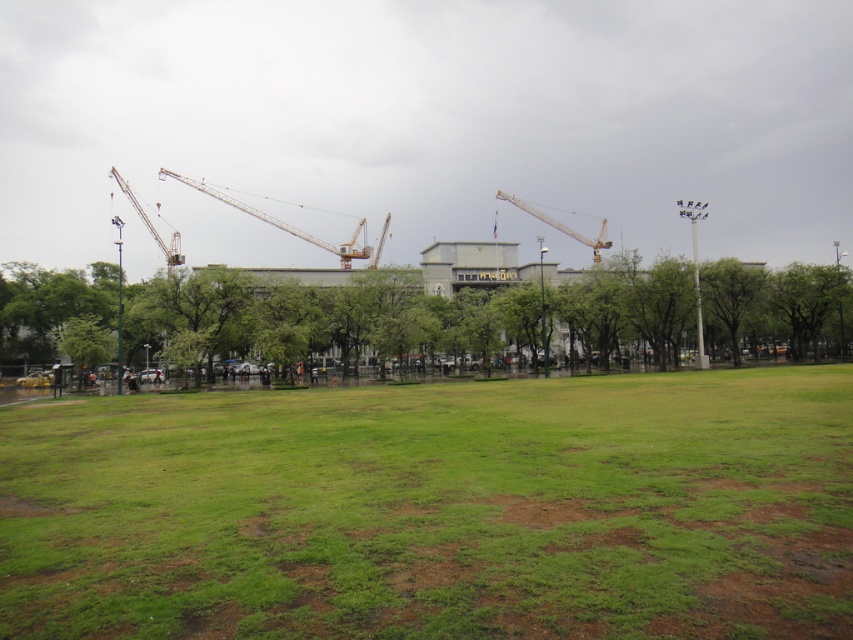
You are standing at the center of the grassy area and want to walk to both the point at coordinates point (166, 349) and the point at coordinates point (578, 236). Which point will you reach first if you walk straight towards them?

You will reach point (166, 349) first because it is in front of point (578, 236), meaning it is closer to your starting position.

You are standing at the origin point of the coordinate system in the image. You want to walk straight ahead to reach the green leafy tree at center. Which direction should you walk to reach it?

Since the green leafy tree at center is located at coordinates approximately 0.494 on the x axis and 0.406 on the y axis, you should walk in the direction of increasing x and y coordinates to reach it.

You are standing at the center of the grassy area and want to locate the green leafy tree at center. According to the coordinates provided, where should you look?

The green leafy tree at center is located at coordinates point (345, 316), so you should look towards the center of the image where those coordinates point to.